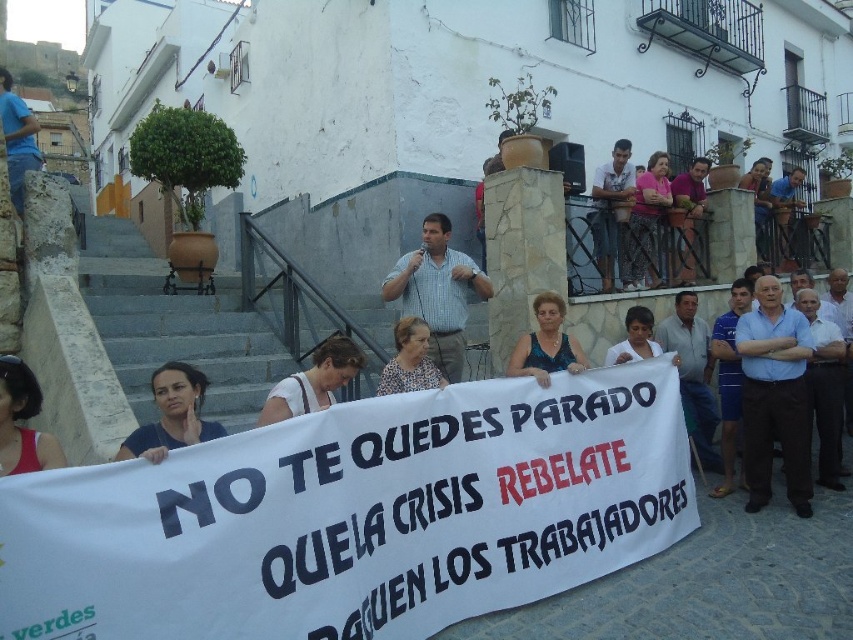
What are the coordinates of the matte blue shirt at lower left?

The coordinates of the matte blue shirt at lower left are at point (x=172, y=413).